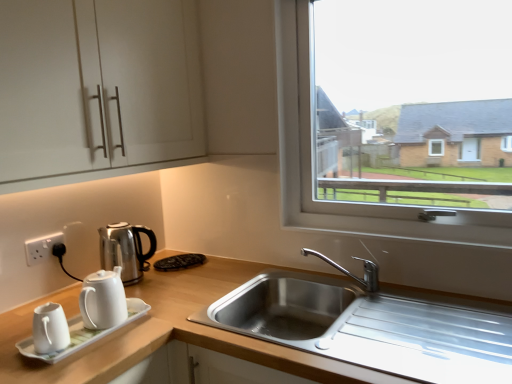
Question: From a real-world perspective, does stainless steel sink at lower center stand above white matte cabinet at upper left?

Choices:
 (A) no
 (B) yes

Answer: (A)

Question: From a real-world perspective, is stainless steel sink at lower center under white matte cabinet at upper left?

Choices:
 (A) yes
 (B) no

Answer: (A)

Question: Can you confirm if stainless steel sink at lower center is shorter than white matte cabinet at upper left?

Choices:
 (A) yes
 (B) no

Answer: (A)

Question: Can you confirm if stainless steel sink at lower center is thinner than white matte cabinet at upper left?

Choices:
 (A) yes
 (B) no

Answer: (B)

Question: Is stainless steel sink at lower center behind white matte cabinet at upper left?

Choices:
 (A) yes
 (B) no

Answer: (B)

Question: Would you say white ceramic tea set at lower left is to the left or to the right of chrome metallic faucet at sink right in the picture?

Choices:
 (A) left
 (B) right

Answer: (A)

Question: Considering their positions, is white ceramic tea set at lower left located in front of or behind chrome metallic faucet at sink right?

Choices:
 (A) front
 (B) behind

Answer: (A)

Question: From the image's perspective, is white ceramic tea set at lower left positioned above or below chrome metallic faucet at sink right?

Choices:
 (A) below
 (B) above

Answer: (A)

Question: Is white ceramic tea set at lower left taller or shorter than chrome metallic faucet at sink right?

Choices:
 (A) tall
 (B) short

Answer: (B)

Question: Is white matte cabinet at upper left inside the boundaries of stainless steel sink at lower center, or outside?

Choices:
 (A) outside
 (B) inside

Answer: (A)

Question: In terms of width, does white matte cabinet at upper left look wider or thinner when compared to stainless steel sink at lower center?

Choices:
 (A) wide
 (B) thin

Answer: (B)

Question: Considering the positions of point (233, 122) and point (262, 279), is point (233, 122) closer or farther from the camera than point (262, 279)?

Choices:
 (A) farther
 (B) closer

Answer: (A)

Question: Considering the positions of white matte cabinet at upper left and stainless steel sink at lower center in the image, is white matte cabinet at upper left taller or shorter than stainless steel sink at lower center?

Choices:
 (A) tall
 (B) short

Answer: (A)

Question: Is white glossy coffee pot at left bigger or smaller than white plastic electric outlet at lower left?

Choices:
 (A) small
 (B) big

Answer: (B)

Question: In terms of width, does white glossy coffee pot at left look wider or thinner when compared to white plastic electric outlet at lower left?

Choices:
 (A) thin
 (B) wide

Answer: (B)